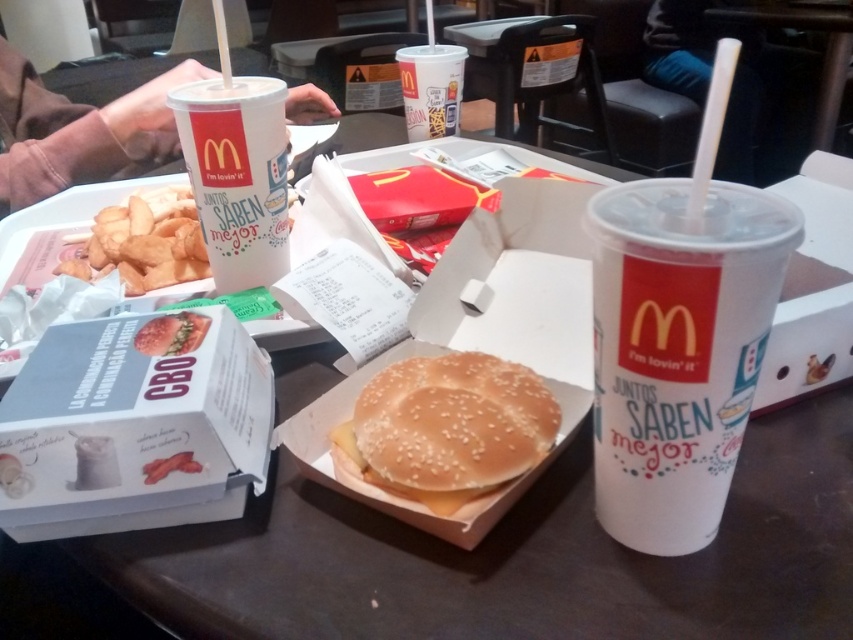
You are sitting at the table and want to reach for both items. Which point is closer to you, point (212, 147) or point (434, 77)?

Point (212, 147) is in front of point (434, 77), so it is closer to you.

You are a customer at McDonalds and want to grab the shiny red bacon at center without touching the white paper cup at center. Can you reach it from the left side?

The white paper cup at center is positioned on the right side of shiny red bacon at center, so yes, you can reach the shiny red bacon at center from the left side without touching the cup.